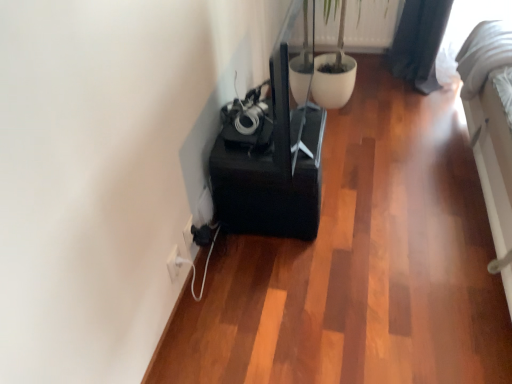
Question: Is green matte plant at upper center smaller than white plastic electric outlet at lower left, the 1th electric outlet viewed from the back?

Choices:
 (A) yes
 (B) no

Answer: (B)

Question: Can you confirm if green matte plant at upper center is taller than white plastic electric outlet at lower left, the 2th electric outlet from the front?

Choices:
 (A) no
 (B) yes

Answer: (B)

Question: Are green matte plant at upper center and white plastic electric outlet at lower left, the 1th electric outlet from the right, located far from each other?

Choices:
 (A) no
 (B) yes

Answer: (B)

Question: Is green matte plant at upper center positioned beyond the bounds of white plastic electric outlet at lower left, the 1th electric outlet viewed from the back?

Choices:
 (A) no
 (B) yes

Answer: (B)

Question: Is green matte plant at upper center bigger than white plastic electric outlet at lower left, the 1th electric outlet from the right?

Choices:
 (A) no
 (B) yes

Answer: (B)

Question: Looking at their shapes, would you say white plastic electric outlet at lower left, the 1th electric outlet from the right, is wider or thinner than white plastic electric outlet at lower left, positioned as the 1th electric outlet in left-to-right order?

Choices:
 (A) thin
 (B) wide

Answer: (B)

Question: In the image, is white plastic electric outlet at lower left, the 1th electric outlet viewed from the back, on the left side or the right side of white plastic electric outlet at lower left, placed as the 1th electric outlet when sorted from front to back?

Choices:
 (A) right
 (B) left

Answer: (A)

Question: Would you say white plastic electric outlet at lower left, which is the 2th electric outlet in left-to-right order, is inside or outside white plastic electric outlet at lower left, marked as the 2th electric outlet in a back-to-front arrangement?

Choices:
 (A) outside
 (B) inside

Answer: (A)

Question: From a real-world perspective, is white plastic electric outlet at lower left, the 2th electric outlet from the front, positioned above or below white plastic electric outlet at lower left, positioned as the 1th electric outlet in left-to-right order?

Choices:
 (A) below
 (B) above

Answer: (A)

Question: In terms of width, does green matte plant at upper center look wider or thinner when compared to white plastic electric outlet at lower left, positioned as the 1th electric outlet in left-to-right order?

Choices:
 (A) wide
 (B) thin

Answer: (A)

Question: Considering the positions of point (348, 6) and point (173, 249), is point (348, 6) closer or farther from the camera than point (173, 249)?

Choices:
 (A) farther
 (B) closer

Answer: (A)

Question: Considering the positions of green matte plant at upper center and white plastic electric outlet at lower left, positioned as the 1th electric outlet in left-to-right order, in the image, is green matte plant at upper center taller or shorter than white plastic electric outlet at lower left, positioned as the 1th electric outlet in left-to-right order,?

Choices:
 (A) tall
 (B) short

Answer: (A)

Question: Is green matte plant at upper center in front of or behind white plastic electric outlet at lower left, marked as the 2th electric outlet in a back-to-front arrangement, in the image?

Choices:
 (A) behind
 (B) front

Answer: (A)

Question: Considering the positions of point (190, 258) and point (296, 31), is point (190, 258) closer or farther from the camera than point (296, 31)?

Choices:
 (A) farther
 (B) closer

Answer: (A)

Question: From a real-world perspective, is white plastic electric outlet at lower left, the 2th electric outlet from the front, physically located above or below green matte plant at upper center?

Choices:
 (A) above
 (B) below

Answer: (B)